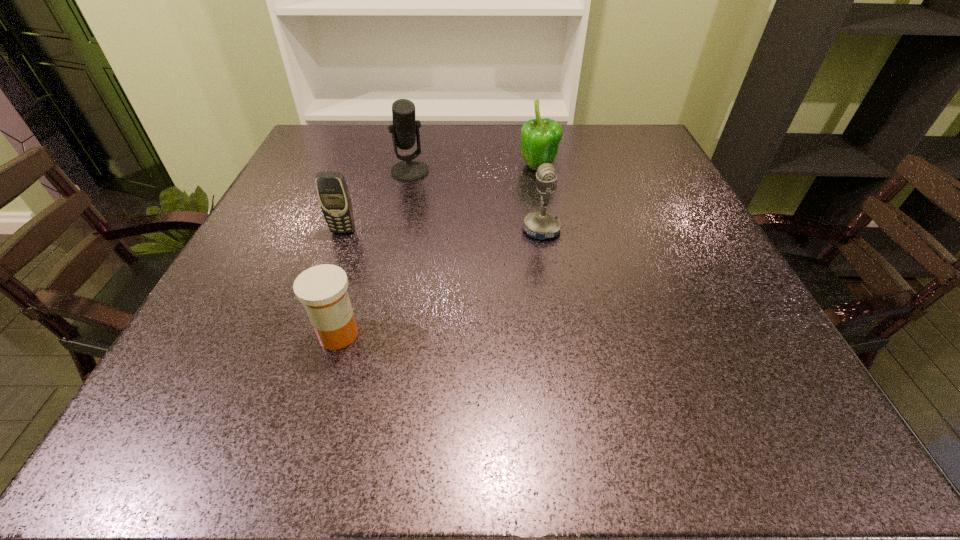
Identify the location of free space that is in between the shortest object and the nearer microphone. (440, 282).

Identify which object is located as the nearest to the bell pepper. Please provide its 2D coordinates. Your answer should be formatted as a tuple, i.e. [(x, y)], where the tuple contains the x and y coordinates of a point satisfying the conditions above.

[(540, 225)]

At what (x,y) coordinates should I click in order to perform the action: click on object that is the fourth nearest to the nearest object. Please return your answer as a coordinate pair (x, y). This screenshot has height=540, width=960. Looking at the image, I should click on (540, 138).